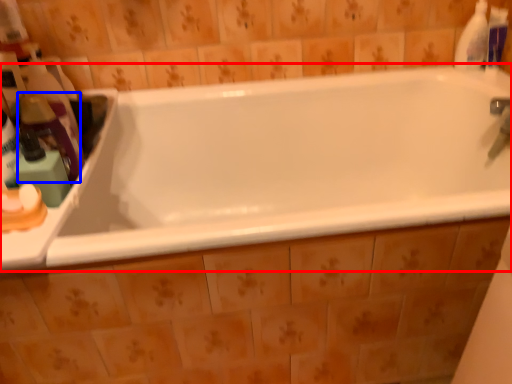
Question: Which point is closer to the camera, bathtub (highlighted by a red box) or cleaning product (highlighted by a blue box)?

Choices:
 (A) bathtub
 (B) cleaning product

Answer: (A)